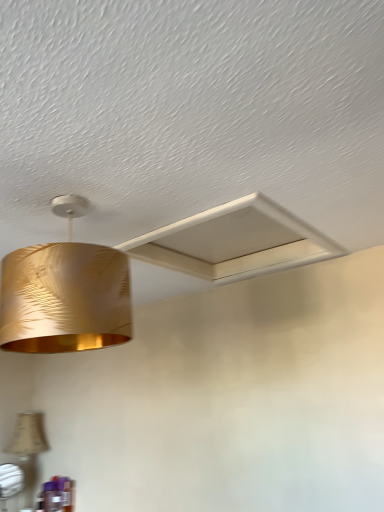
Question: From a real-world perspective, is beige fabric lampshade at lower left, acting as the 2th lamp starting from the right, physically located above or below white matte exhaust hood at upper center?

Choices:
 (A) below
 (B) above

Answer: (A)

Question: Considering the positions of beige fabric lampshade at lower left, which is the first lamp in back-to-front order, and white matte exhaust hood at upper center in the image, is beige fabric lampshade at lower left, which is the first lamp in back-to-front order, wider or thinner than white matte exhaust hood at upper center?

Choices:
 (A) wide
 (B) thin

Answer: (B)

Question: Which object is the farthest from the gold metallic lampshade at upper left, which appears as the 2th lamp when viewed from the left?

Choices:
 (A) beige fabric lampshade at lower left, placed as the first lamp when sorted from left to right
 (B) white matte exhaust hood at upper center

Answer: (A)

Question: Based on their relative distances, which object is farther from the gold metallic lampshade at upper left, the 1th lamp viewed from the right?

Choices:
 (A) beige fabric lampshade at lower left, acting as the 2th lamp starting from the right
 (B) white matte exhaust hood at upper center

Answer: (A)